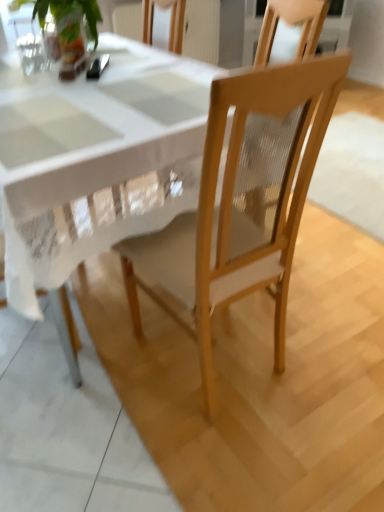
Identify the location of blank space to the left of light wood chair at center. This screenshot has height=512, width=384. (95, 366).